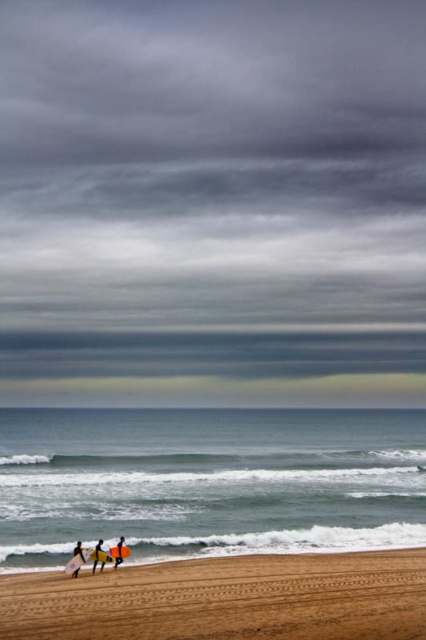
Between brown sandy beach at lower center and yellow foam surfboard at lower center, which one is positioned higher?

Positioned higher is brown sandy beach at lower center.

This screenshot has height=640, width=426. Find the location of `brown sandy beach at lower center`. brown sandy beach at lower center is located at coordinates (226, 600).

Is point (103, 611) farther from camera compared to point (100, 561)?

No, (103, 611) is in front of (100, 561).

Identify the location of brown sandy beach at lower center. The width and height of the screenshot is (426, 640). 226,600.

The height and width of the screenshot is (640, 426). What do you see at coordinates (98, 556) in the screenshot? I see `yellow foam surfboard at lower center` at bounding box center [98, 556].

Is point (103, 563) more distant than point (77, 572)?

Yes, it is behind point (77, 572).

Is point (104, 560) in front of point (80, 541)?

Yes, it is in front of point (80, 541).

At what (x,y) coordinates should I click in order to perform the action: click on yellow foam surfboard at lower center. Please return your answer as a coordinate pair (x, y). The width and height of the screenshot is (426, 640). Looking at the image, I should click on (98, 556).

Between point (101, 568) and point (118, 561), which one is positioned in front?

Point (101, 568) is more forward.

Who is taller, yellow foam surfboard at lower center or smooth yellow surfboard at lower left?

With more height is yellow foam surfboard at lower center.

Which is behind, point (100, 540) or point (118, 557)?

Positioned behind is point (100, 540).

You are a GUI agent. You are given a task and a screenshot of the screen. Output one action in this format:
    pyautogui.click(x=<x>, y=<y>)
    Task: Click on the yellow foam surfboard at lower center
    This screenshot has height=640, width=426.
    Given the screenshot: What is the action you would take?
    pyautogui.click(x=98, y=556)